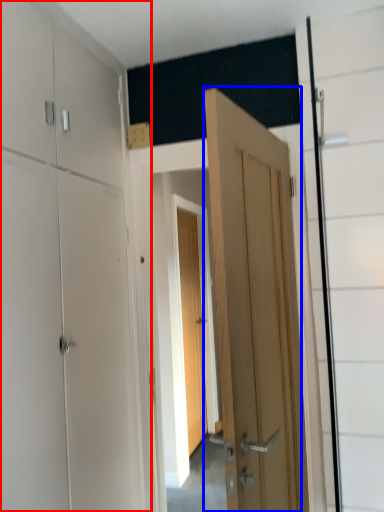
Question: Which object is further to the camera taking this photo, dresser (highlighted by a red box) or door (highlighted by a blue box)?

Choices:
 (A) dresser
 (B) door

Answer: (B)